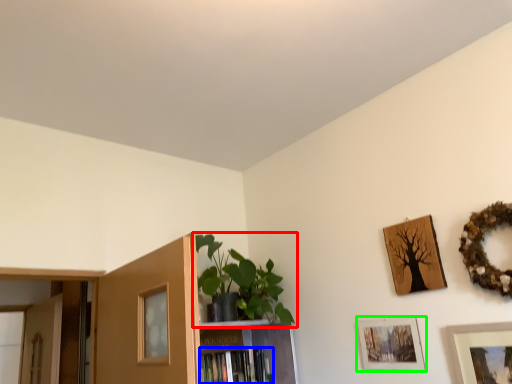
Question: Estimate the real-world distances between objects in this image. Which object is farther from houseplant (highlighted by a red box), book (highlighted by a blue box) or picture frame (highlighted by a green box)?

Choices:
 (A) book
 (B) picture frame

Answer: (B)